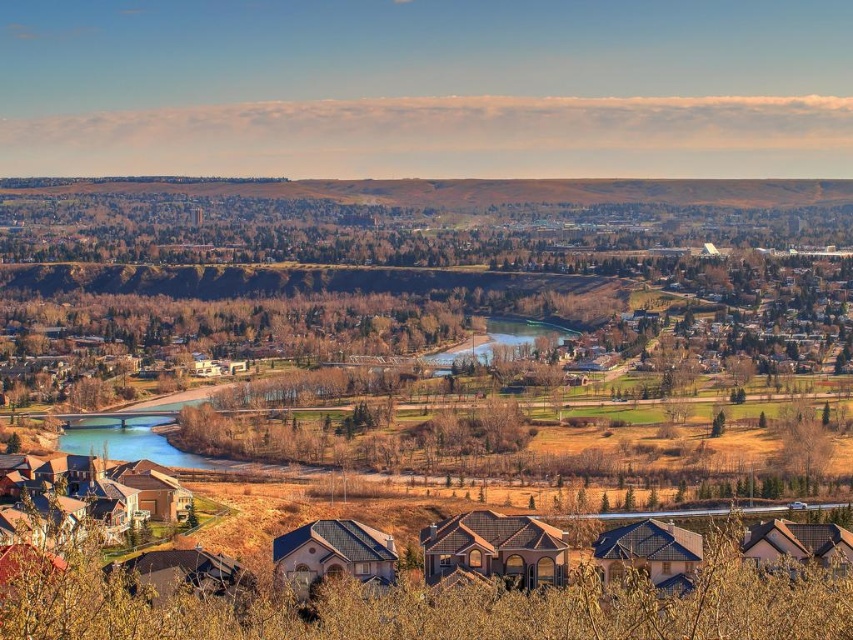
Is clear glass river at center smaller than greenish-brown water at center?

No, clear glass river at center is not smaller than greenish-brown water at center.

Is point (91, 451) in front of point (566, 332)?

No, it is not.

Where is `clear glass river at center`? clear glass river at center is located at coordinates (135, 440).